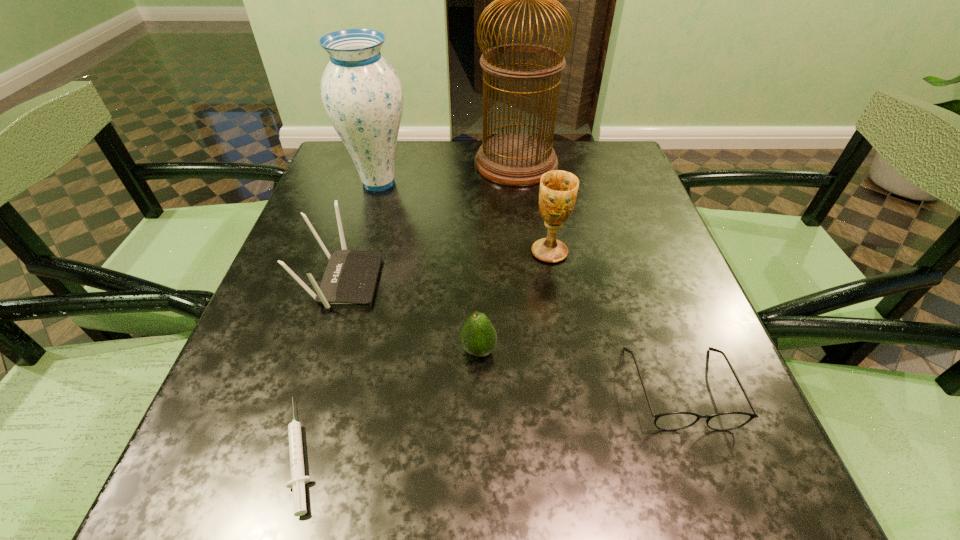
This screenshot has width=960, height=540. Identify the location of vacant space positioned 0.160m on the front-facing side of the tallest object. (414, 163).

This screenshot has height=540, width=960. I want to click on free space located 0.230m on the right of the sixth shortest object, so click(506, 183).

Locate an element on the screen. This screenshot has width=960, height=540. free location located 0.070m on the back of the chalice is located at coordinates (544, 220).

The width and height of the screenshot is (960, 540). Identify the location of vacant space situated on the front-facing side of the fourth tallest object. (404, 281).

I want to click on vacant space located on the right of the avocado, so click(x=622, y=350).

Where is `free space located 0.050m on the front-facing side of the second shortest object`? This screenshot has width=960, height=540. free space located 0.050m on the front-facing side of the second shortest object is located at coordinates (708, 467).

Where is `vacant space located 0.070m on the right of the shortest object`? The height and width of the screenshot is (540, 960). vacant space located 0.070m on the right of the shortest object is located at coordinates (374, 454).

Identify the location of birdcage present at the far edge. (515, 159).

Identify the location of vase located in the far edge section of the desktop. (362, 95).

Where is `object present at the near edge`? The width and height of the screenshot is (960, 540). object present at the near edge is located at coordinates (298, 480).